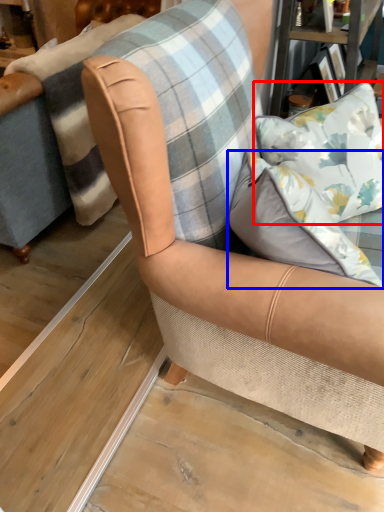
Question: Which object appears closest to the camera in this image, pillow (highlighted by a red box) or pillow (highlighted by a blue box)?

Choices:
 (A) pillow
 (B) pillow

Answer: (B)